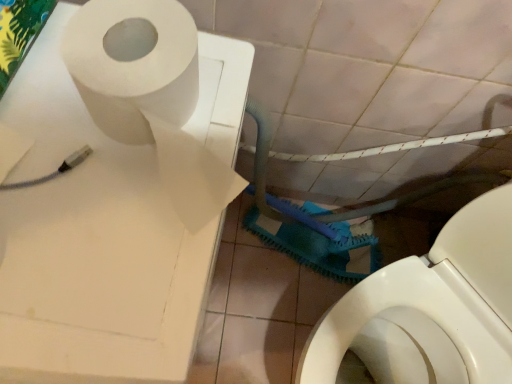
In order to face white matte toilet paper at upper left, should I rotate leftwards or rightwards?

To face it directly, rotate left by 13.744 degrees.

At what (x,y) coordinates should I click in order to perform the action: click on white matte toilet paper at upper left. Please return your answer as a coordinate pair (x, y). This screenshot has width=512, height=384. Looking at the image, I should click on (149, 94).

This screenshot has height=384, width=512. What do you see at coordinates (149, 94) in the screenshot?
I see `white matte toilet paper at upper left` at bounding box center [149, 94].

Locate an element on the screen. white matte toilet paper at upper left is located at coordinates (149, 94).